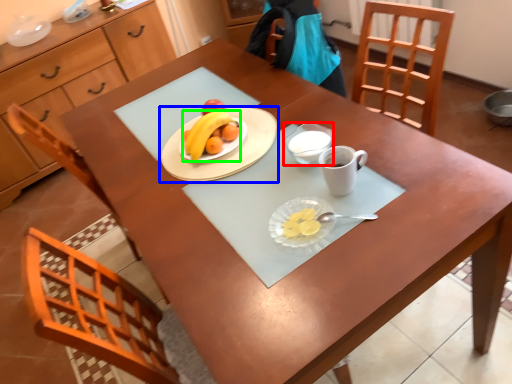
Question: Estimate the real-world distances between objects in this image. Which object is closer to glass bowl (highlighted by a red box), tableware (highlighted by a blue box) or grapefruit (highlighted by a green box)?

Choices:
 (A) tableware
 (B) grapefruit

Answer: (A)